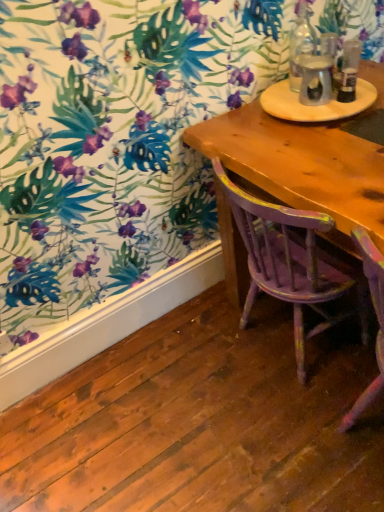
Identify the location of vacant area that lies in front of translucent glass bottle at upper right. This screenshot has height=512, width=384. pyautogui.click(x=326, y=112).